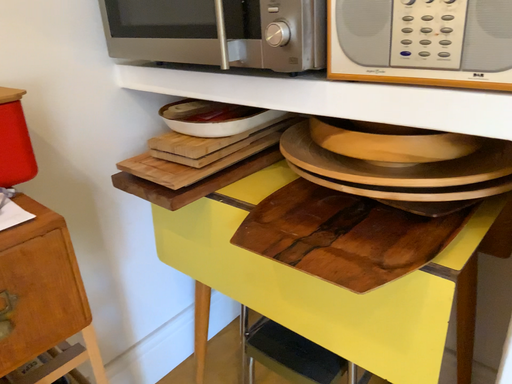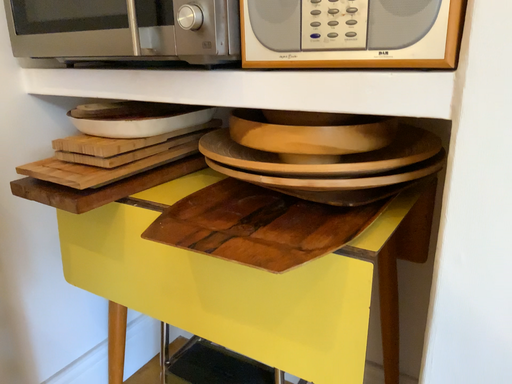
Question: Which way did the camera rotate in the video?

Choices:
 (A) rotated right
 (B) rotated left

Answer: (A)